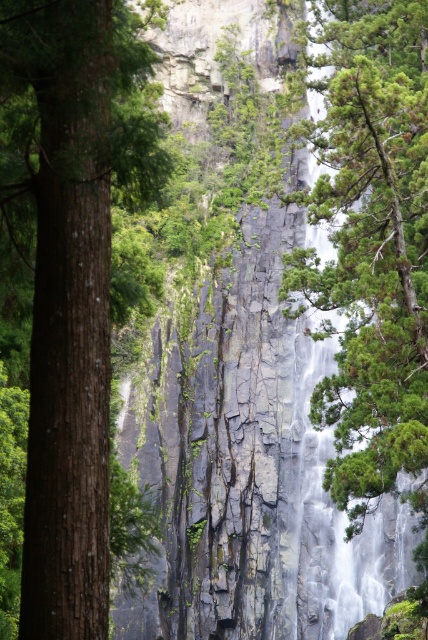
Is brown rough tree trunk at left above green textured tree at right?

Yes.

Consider the image. Can you confirm if brown rough tree trunk at left is taller than green textured tree at right?

No, brown rough tree trunk at left is not taller than green textured tree at right.

Which is in front, point (36, 604) or point (338, 275)?

Point (36, 604) is in front.

Identify the location of brown rough tree trunk at left. This screenshot has height=640, width=428. (71, 276).